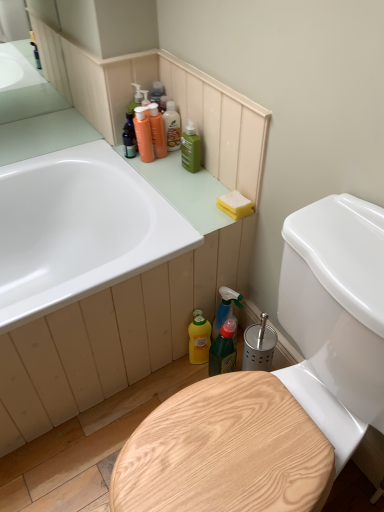
Locate an element on the screen. The height and width of the screenshot is (512, 384). free space in front of translucent amber bottle at upper center, the first cleaning product from the top is located at coordinates [x=168, y=170].